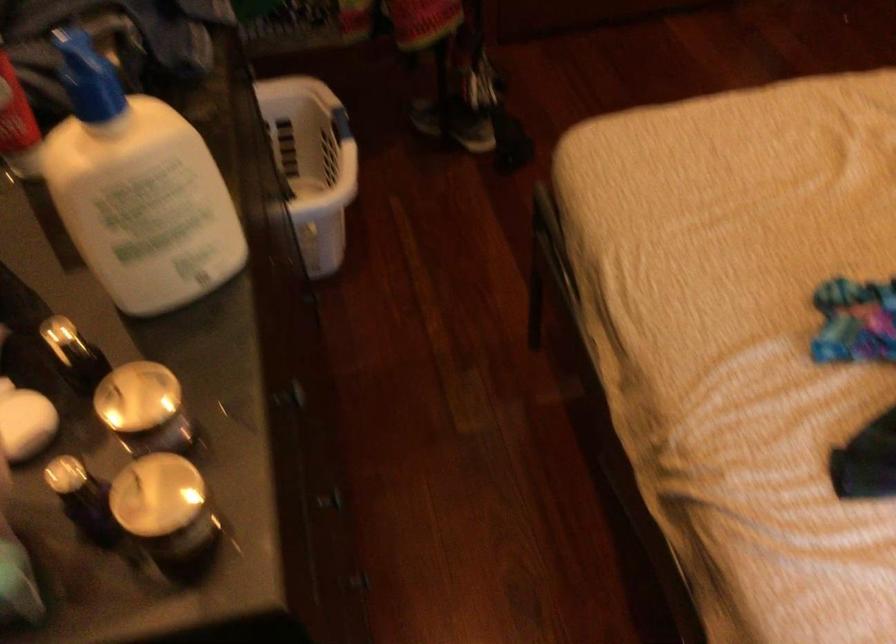
This screenshot has height=644, width=896. What do you see at coordinates (312, 164) in the screenshot?
I see `the white laundry basket` at bounding box center [312, 164].